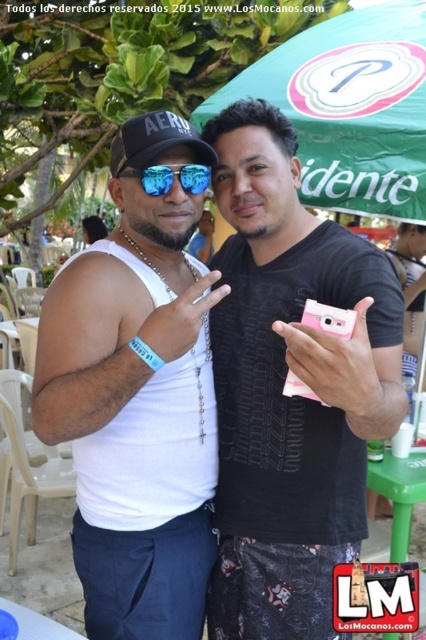
Question: Which point is closer to the camera?

Choices:
 (A) (150, 186)
 (B) (141, 138)

Answer: (A)

Question: Which object appears farthest from the camera in this image?

Choices:
 (A) black matte baseball cap at upper left
 (B) shiny reflective sunglasses at center

Answer: (B)

Question: Is green fabric canopy at upper center bigger than shiny reflective sunglasses at center?

Choices:
 (A) yes
 (B) no

Answer: (A)

Question: Is green fabric canopy at upper center further to camera compared to black matte baseball cap at upper left?

Choices:
 (A) no
 (B) yes

Answer: (B)

Question: Does green fabric canopy at upper center come behind black matte baseball cap at upper left?

Choices:
 (A) yes
 (B) no

Answer: (A)

Question: Which is farther from the green fabric canopy at upper center?

Choices:
 (A) black matte baseball cap at upper left
 (B) shiny reflective sunglasses at center

Answer: (B)